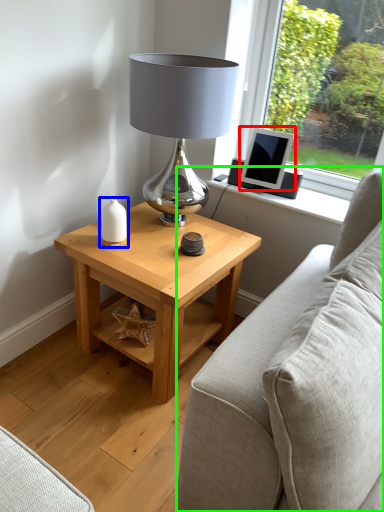
Question: Which is nearer to the computer monitor (highlighted by a red box)? candle holder (highlighted by a blue box) or studio couch (highlighted by a green box).

Choices:
 (A) candle holder
 (B) studio couch

Answer: (A)